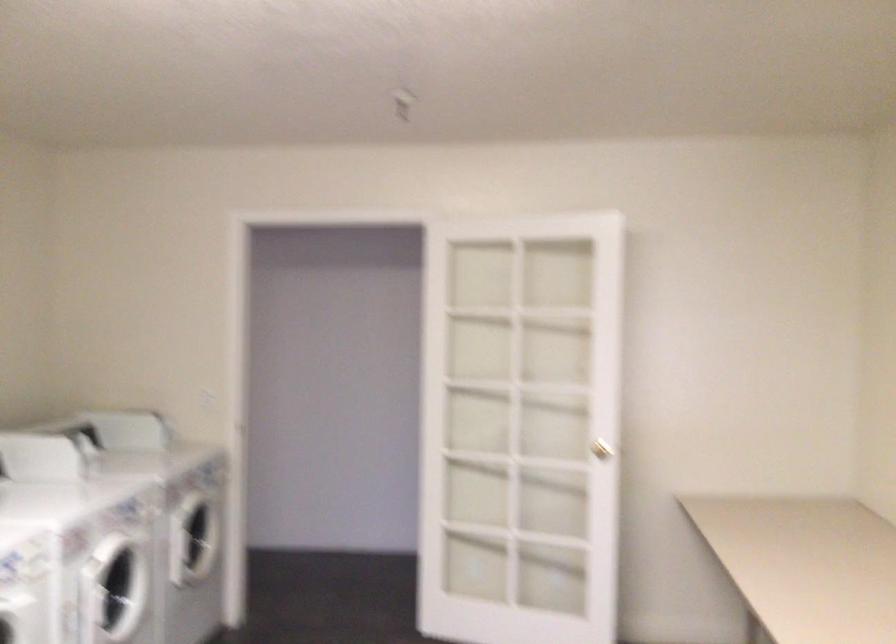
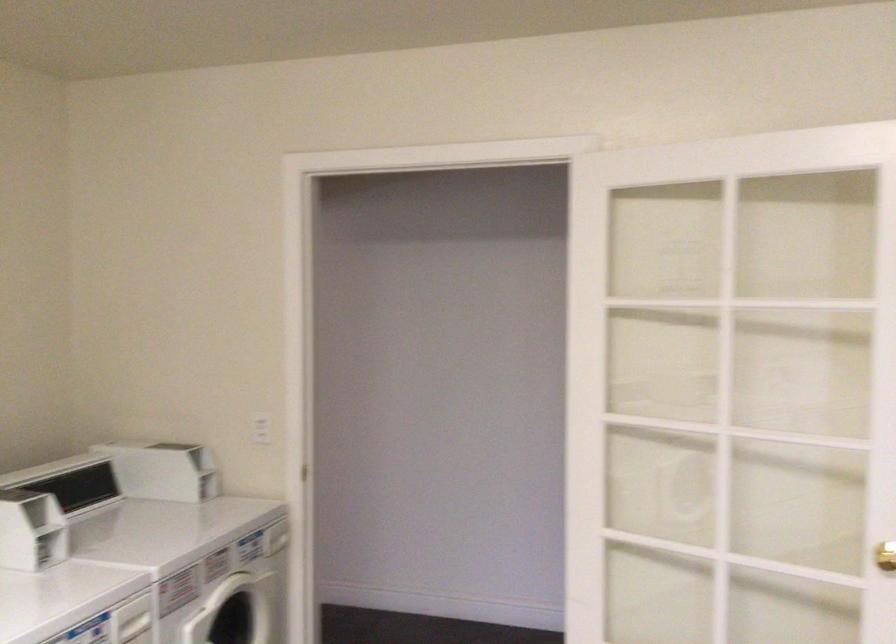
In the second image, find the point that corresponds to [204,398] in the first image.

(261, 428)